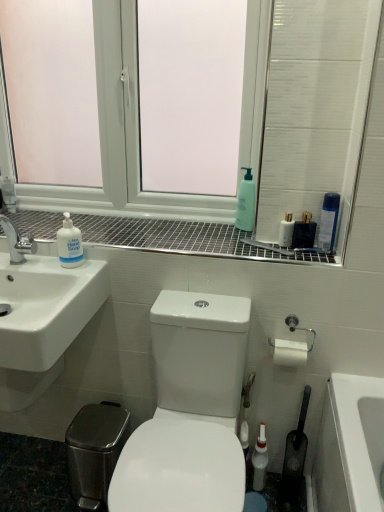
Question: Is silver metallic toilet paper holder at right smaller than white glossy toilet at center?

Choices:
 (A) yes
 (B) no

Answer: (A)

Question: Is silver metallic toilet paper holder at right next to white glossy toilet at center?

Choices:
 (A) no
 (B) yes

Answer: (A)

Question: Is silver metallic toilet paper holder at right aimed at white glossy toilet at center?

Choices:
 (A) yes
 (B) no

Answer: (B)

Question: Is silver metallic toilet paper holder at right not near white glossy toilet at center?

Choices:
 (A) no
 (B) yes

Answer: (A)

Question: Can you confirm if silver metallic toilet paper holder at right is positioned to the left of white glossy toilet at center?

Choices:
 (A) yes
 (B) no

Answer: (B)

Question: Is clear plastic spray bottle at upper right, which appears as the first cleaning product when viewed from the right, situated inside white glossy mouthwash at upper right, positioned as the 2th mouthwash in bottom-to-top order, or outside?

Choices:
 (A) inside
 (B) outside

Answer: (B)

Question: Considering the positions of clear plastic spray bottle at upper right, the second cleaning product positioned from the left, and white glossy mouthwash at upper right, marked as the second mouthwash in a right-to-left arrangement, in the image, is clear plastic spray bottle at upper right, the second cleaning product positioned from the left, bigger or smaller than white glossy mouthwash at upper right, marked as the second mouthwash in a right-to-left arrangement,?

Choices:
 (A) small
 (B) big

Answer: (B)

Question: Considering the positions of clear plastic spray bottle at upper right, which appears as the first cleaning product when viewed from the right, and white glossy mouthwash at upper right, the 2th mouthwash in the left-to-right sequence, in the image, is clear plastic spray bottle at upper right, which appears as the first cleaning product when viewed from the right, taller or shorter than white glossy mouthwash at upper right, the 2th mouthwash in the left-to-right sequence,?

Choices:
 (A) tall
 (B) short

Answer: (A)

Question: From a real-world perspective, is clear plastic spray bottle at upper right, the second cleaning product positioned from the left, positioned above or below white glossy mouthwash at upper right, the 2th mouthwash in the left-to-right sequence?

Choices:
 (A) below
 (B) above

Answer: (B)

Question: From the image's perspective, is white glossy toilet at center positioned above or below white plastic window at upper center?

Choices:
 (A) below
 (B) above

Answer: (A)

Question: Considering the positions of point (233, 496) and point (354, 70), is point (233, 496) closer or farther from the camera than point (354, 70)?

Choices:
 (A) closer
 (B) farther

Answer: (A)

Question: Based on their sizes in the image, would you say white glossy toilet at center is bigger or smaller than white plastic window at upper center?

Choices:
 (A) big
 (B) small

Answer: (A)

Question: Is white glossy toilet at center wider or thinner than white plastic window at upper center?

Choices:
 (A) thin
 (B) wide

Answer: (B)

Question: Considering the positions of white glossy bottle at lower center, arranged as the first mouthwash when ordered from the bottom, and white plastic window at upper center in the image, is white glossy bottle at lower center, arranged as the first mouthwash when ordered from the bottom, wider or thinner than white plastic window at upper center?

Choices:
 (A) wide
 (B) thin

Answer: (B)

Question: Considering the relative positions of white glossy bottle at lower center, acting as the third mouthwash starting from the right, and white plastic window at upper center in the image provided, is white glossy bottle at lower center, acting as the third mouthwash starting from the right, to the left or to the right of white plastic window at upper center?

Choices:
 (A) left
 (B) right

Answer: (B)